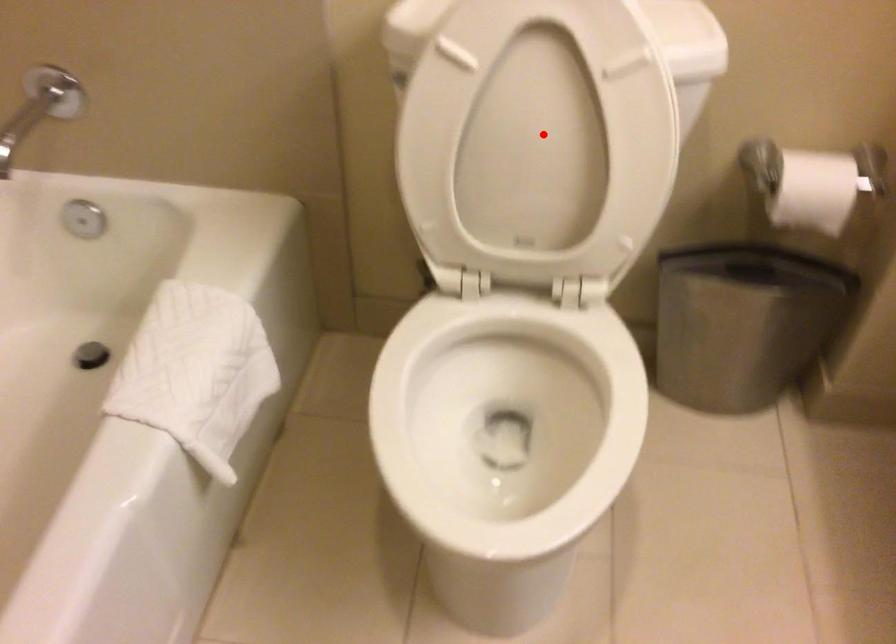
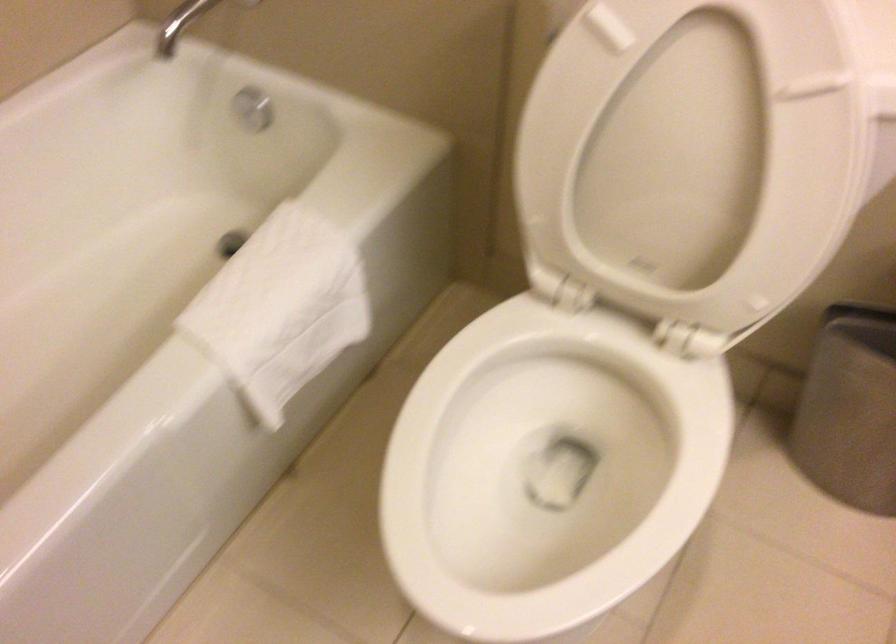
Where in the second image is the point corresponding to the highlighted location from the first image?

(691, 154)